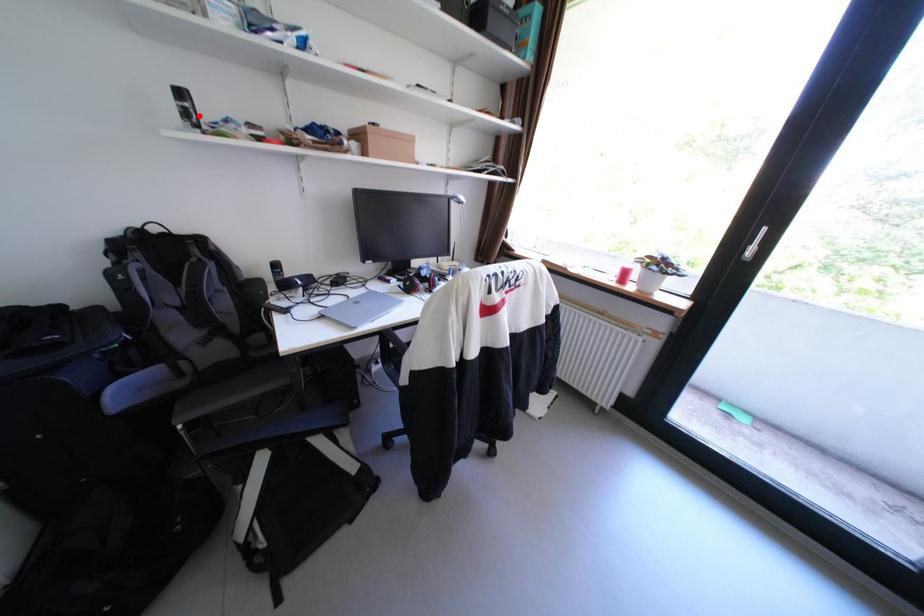
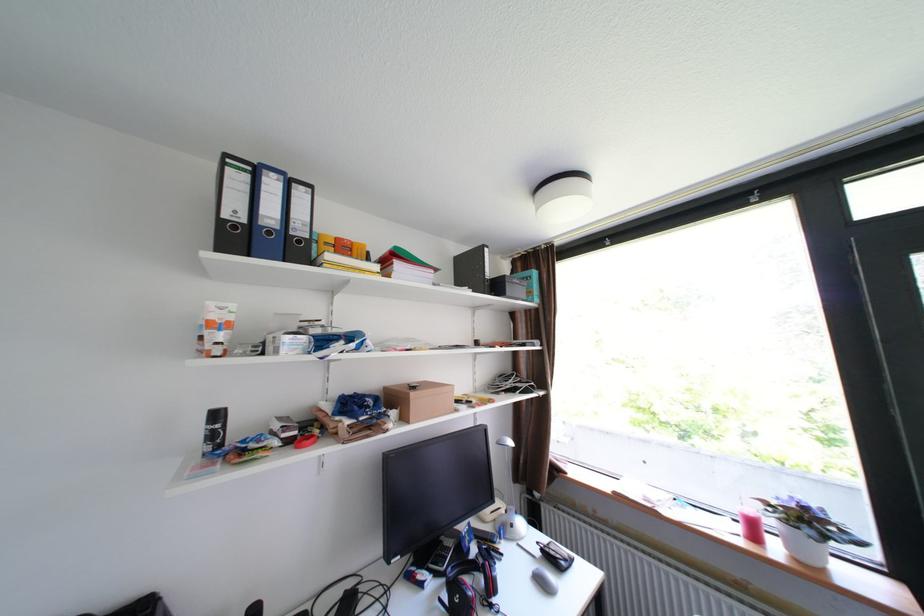
Question: I am providing you with two images of the same scene from different viewpoints. A red point is marked on the first image. At the location where the point appears in image 1, is it still visible in image 2?

Choices:
 (A) Yes
 (B) No

Answer: (A)